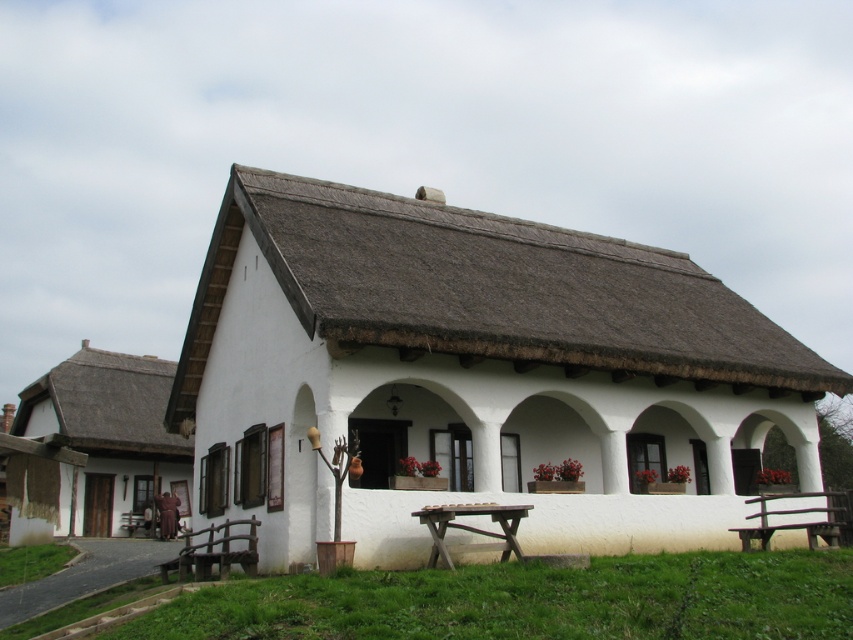
You are standing in front of the rustic house and want to walk from the wooden bench to the picnic table. The wooden bench is located at point (27,390) and the picnic table is at point (433,540). Which direction should you walk to get from the wooden bench to the picnic table?

Since point (27,390) is closer to you than point (433,540), you should walk away from the house towards the picnic table located at point (433,540).

You are planning to set up a garden path leading from the front gate to the brown wooden picnic table at lower center. The white thatched roof cottage at left is in the way. Can you move the cottage to the right to make space for the path?

The white thatched roof cottage at left is positioned on the left side of the brown wooden picnic table at lower center, so moving it to the right would place it closer to the picnic table. However, since the cottage is already on the left side of the picnic table, moving it further right might not be necessary unless the path requires more space. The exact feasibility depends on the path width and layout, but the description only states their relative positions without specifying distances.

You are planning to set up a garden between the white stucco cottage at center and the white thatched roof cottage at left. Since you want the garden to be equally accessible from both cottages, which cottage should you place the garden closer to and why?

You should place the garden closer to the white thatched roof cottage at left because the white stucco cottage at center is wider, meaning the garden needs to be positioned nearer to the narrower cottage to ensure equal accessibility from both.